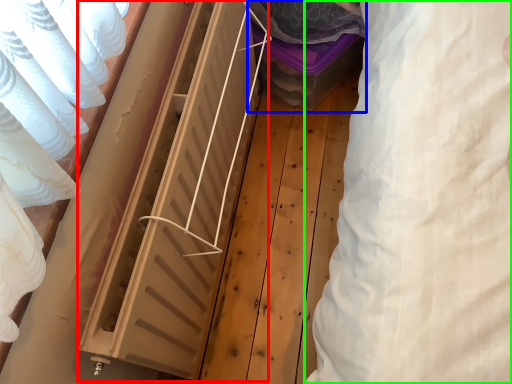
Question: Based on their relative distances, which object is farther from radiator (highlighted by a red box)? Choose from storage box (highlighted by a blue box) and clothing (highlighted by a green box).

Choices:
 (A) storage box
 (B) clothing

Answer: (B)